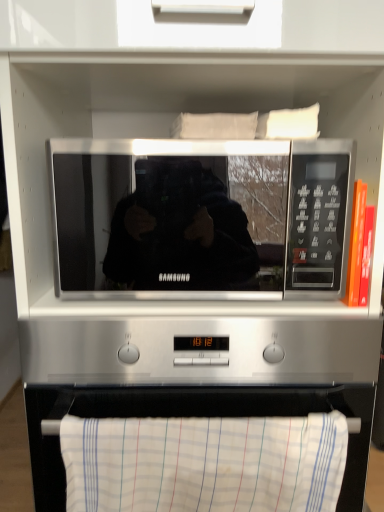
Question: Is white striped towel at lower center further to the viewer compared to black glossy microwave at center?

Choices:
 (A) no
 (B) yes

Answer: (A)

Question: From the image's perspective, is white striped towel at lower center above black glossy microwave at center?

Choices:
 (A) no
 (B) yes

Answer: (A)

Question: Could you tell me if white striped towel at lower center is turned towards black glossy microwave at center?

Choices:
 (A) no
 (B) yes

Answer: (A)

Question: Is white striped towel at lower center positioned beyond the bounds of black glossy microwave at center?

Choices:
 (A) yes
 (B) no

Answer: (A)

Question: Is white striped towel at lower center in contact with black glossy microwave at center?

Choices:
 (A) no
 (B) yes

Answer: (A)

Question: From the image's perspective, is white striped towel at lower center beneath black glossy microwave at center?

Choices:
 (A) no
 (B) yes

Answer: (B)

Question: Considering the relative sizes of black glossy microwave at center and white striped towel at lower center in the image provided, is black glossy microwave at center shorter than white striped towel at lower center?

Choices:
 (A) yes
 (B) no

Answer: (B)

Question: Is black glossy microwave at center facing towards white striped towel at lower center?

Choices:
 (A) no
 (B) yes

Answer: (A)

Question: Considering the relative sizes of black glossy microwave at center and white striped towel at lower center in the image provided, is black glossy microwave at center wider than white striped towel at lower center?

Choices:
 (A) yes
 (B) no

Answer: (A)

Question: Are black glossy microwave at center and white striped towel at lower center beside each other?

Choices:
 (A) yes
 (B) no

Answer: (B)

Question: Considering the relative positions of black glossy microwave at center and white striped towel at lower center in the image provided, is black glossy microwave at center to the right of white striped towel at lower center from the viewer's perspective?

Choices:
 (A) no
 (B) yes

Answer: (A)

Question: Is black glossy microwave at center positioned behind white striped towel at lower center?

Choices:
 (A) no
 (B) yes

Answer: (B)

Question: Would you say white striped towel at lower center is to the left or to the right of black glossy microwave at center in the picture?

Choices:
 (A) right
 (B) left

Answer: (A)